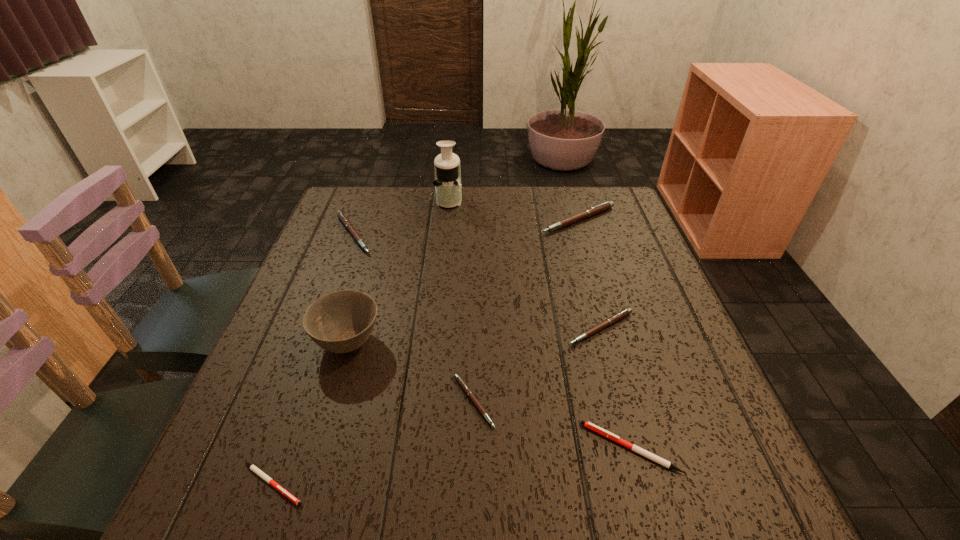
Identify the location of vacant space located on the clicker of the right white pen. Image resolution: width=960 pixels, height=540 pixels. (415, 448).

Identify the location of blank space located on the clicker of the right white pen. This screenshot has width=960, height=540. (356, 448).

Image resolution: width=960 pixels, height=540 pixels. I want to click on vacant space located on the clicker of the right white pen, so click(x=555, y=448).

Locate an element on the screen. Image resolution: width=960 pixels, height=540 pixels. vacant space located on the clicker of the smaller white pen is located at coordinates (390, 484).

What are the coordinates of `juicer at the far edge` in the screenshot? It's located at (447, 182).

Where is `bowl that is positioned at the left edge`? This screenshot has width=960, height=540. bowl that is positioned at the left edge is located at coordinates (342, 321).

What are the coordinates of `object positioned at the far left corner` in the screenshot? It's located at (342, 217).

This screenshot has width=960, height=540. I want to click on object situated at the near left corner, so click(x=256, y=470).

Where is `object at the far right corner`? object at the far right corner is located at coordinates (602, 207).

Identify the location of object located at the near right corner. This screenshot has width=960, height=540. (643, 452).